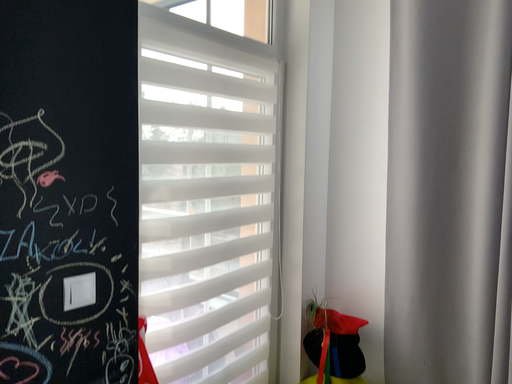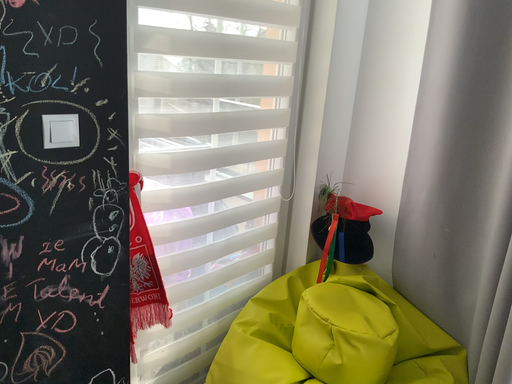
Question: How did the camera likely rotate when shooting the video?

Choices:
 (A) rotated downward
 (B) rotated upward

Answer: (A)